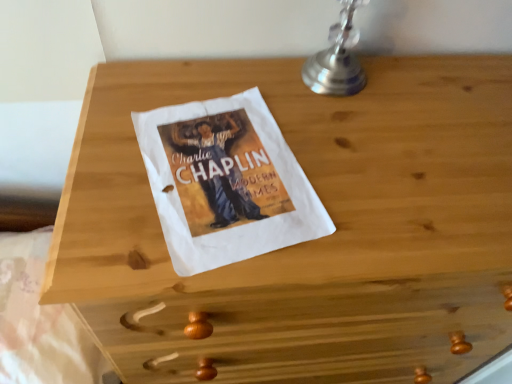
Question: From a real-world perspective, relative to silver metallic table lamp at upper right, is white paper at lower center vertically above or below?

Choices:
 (A) below
 (B) above

Answer: (A)

Question: In terms of width, does white paper at lower center look wider or thinner when compared to silver metallic table lamp at upper right?

Choices:
 (A) thin
 (B) wide

Answer: (B)

Question: Based on their sizes in the image, would you say white paper at lower center is bigger or smaller than silver metallic table lamp at upper right?

Choices:
 (A) big
 (B) small

Answer: (A)

Question: In terms of height, does silver metallic table lamp at upper right look taller or shorter compared to white paper at lower center?

Choices:
 (A) short
 (B) tall

Answer: (B)

Question: In terms of width, does silver metallic table lamp at upper right look wider or thinner when compared to white paper at lower center?

Choices:
 (A) thin
 (B) wide

Answer: (A)

Question: From a real-world perspective, is silver metallic table lamp at upper right positioned above or below white paper at lower center?

Choices:
 (A) above
 (B) below

Answer: (A)

Question: Does point (314, 69) appear closer or farther from the camera than point (66, 370)?

Choices:
 (A) closer
 (B) farther

Answer: (A)